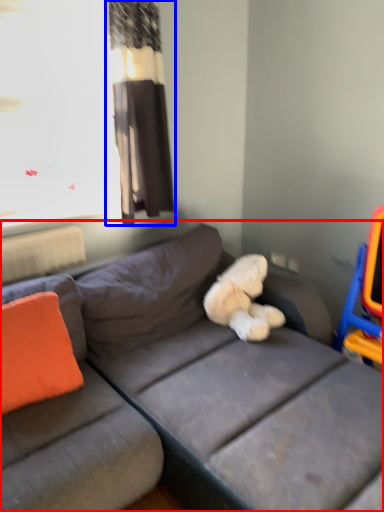
Question: Which of the following is the closest to the observer, studio couch (highlighted by a red box) or curtain (highlighted by a blue box)?

Choices:
 (A) studio couch
 (B) curtain

Answer: (A)